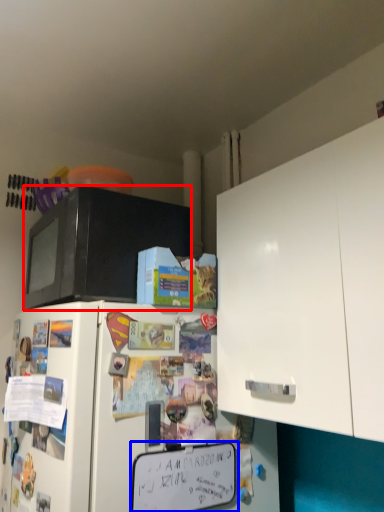
Question: Which object is closer to the camera taking this photo, microwave oven (highlighted by a red box) or bulletin board (highlighted by a blue box)?

Choices:
 (A) microwave oven
 (B) bulletin board

Answer: (B)